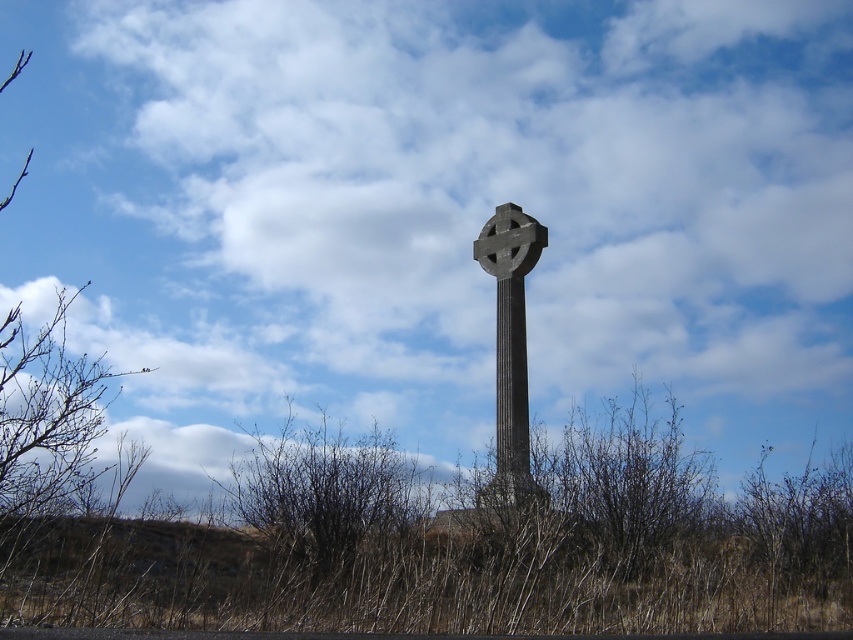
Question: Can you confirm if brown dry grass at lower center is positioned to the left of gray stone cross at center?

Choices:
 (A) yes
 (B) no

Answer: (A)

Question: Does brown dry grass at center appear under brown dry grass at lower center?

Choices:
 (A) no
 (B) yes

Answer: (B)

Question: Which point appears farthest from the camera in this image?

Choices:
 (A) (500, 346)
 (B) (334, 524)

Answer: (A)

Question: Estimate the real-world distances between objects in this image. Which object is farther from the brown dry grass at lower center?

Choices:
 (A) gray stone cross at center
 (B) brown dry grass at center

Answer: (A)

Question: Which point is farther from the camera taking this photo?

Choices:
 (A) (515, 461)
 (B) (334, 444)
 (C) (802, 484)

Answer: (C)

Question: Is brown dry grass at lower center smaller than gray stone cross at center?

Choices:
 (A) yes
 (B) no

Answer: (A)